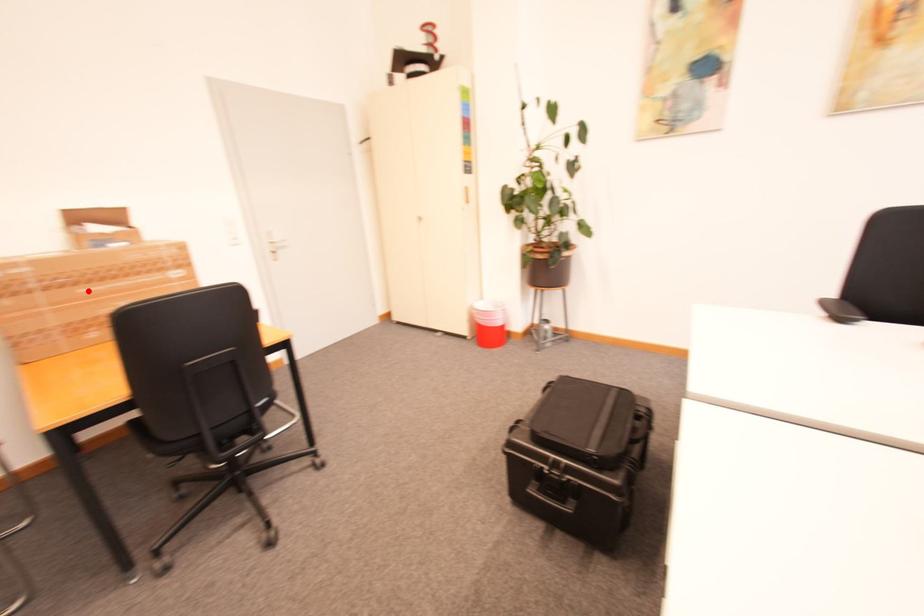
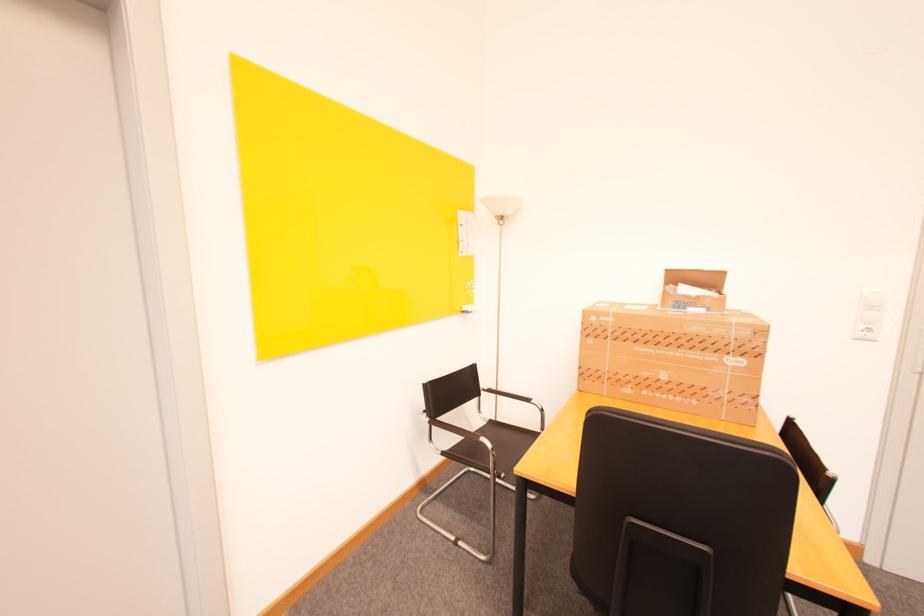
The point at the highlighted location is marked in the first image. Where is the corresponding point in the second image?

(643, 349)